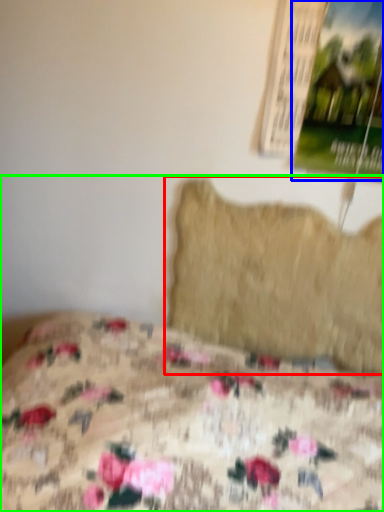
Question: Based on their relative distances, which object is nearer to pillow (highlighted by a red box)? Choose from poster page (highlighted by a blue box) and bed (highlighted by a green box).

Choices:
 (A) poster page
 (B) bed

Answer: (A)